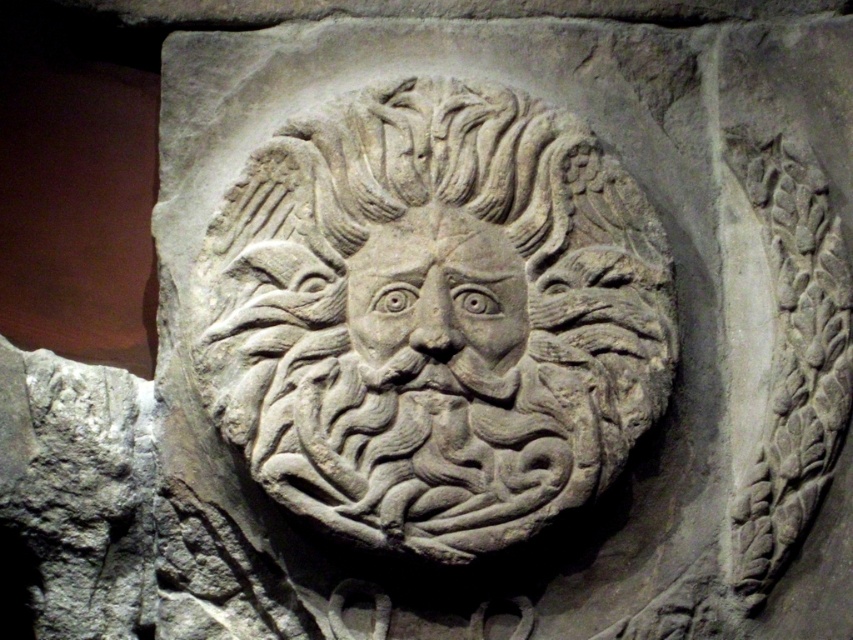
Can you confirm if gray stone lion at center is thinner than carved stone face at center?

No.

Between point (463, 404) and point (364, 316), which one is positioned behind?

The point (364, 316) is more distant.

What are the coordinates of `gray stone lion at center` in the screenshot? It's located at (434, 317).